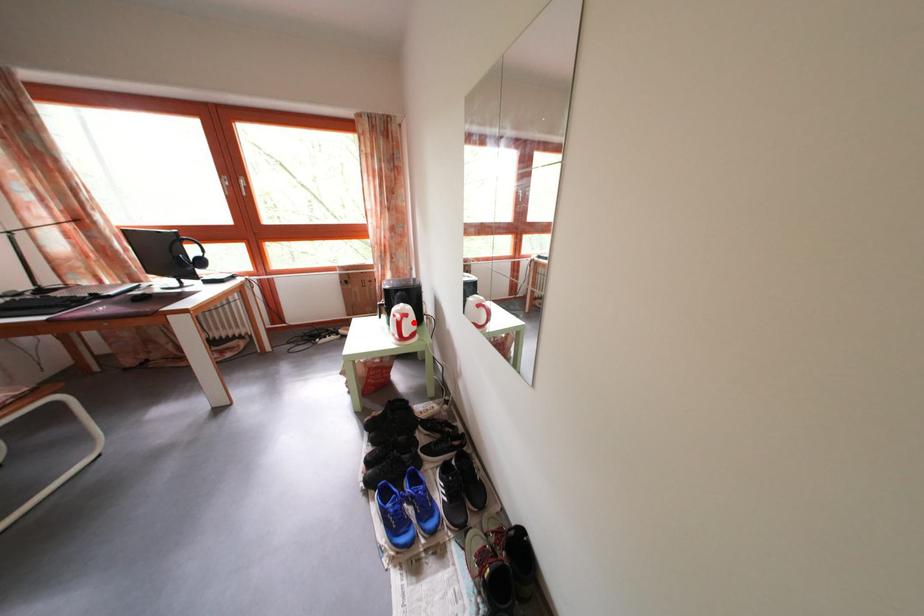
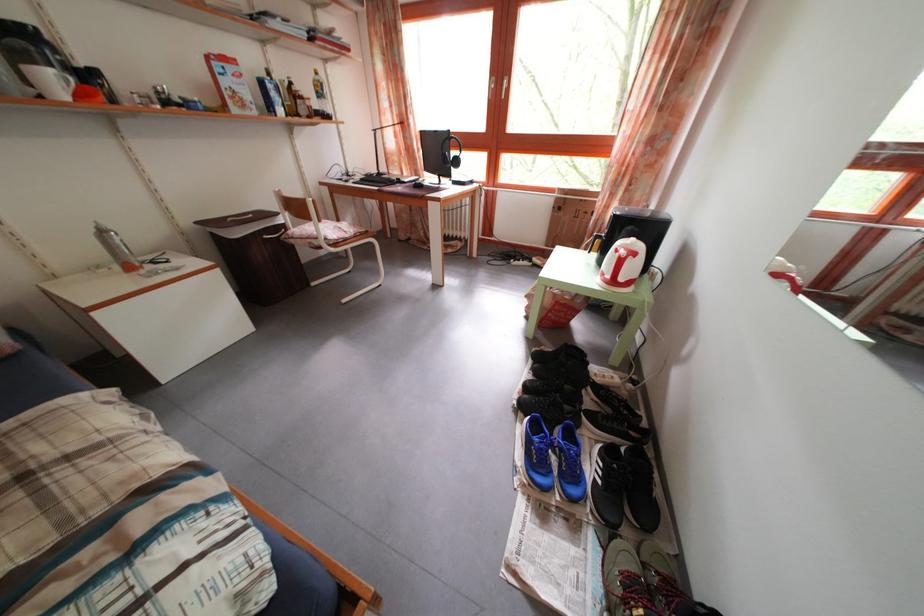
Question: I am providing you with two images of the same scene from different viewpoints. Given a red point in image1, look at the same physical point in image2. Is it:

Choices:
 (A) Closer to the viewpoint
 (B) Farther from the viewpoint

Answer: (B)